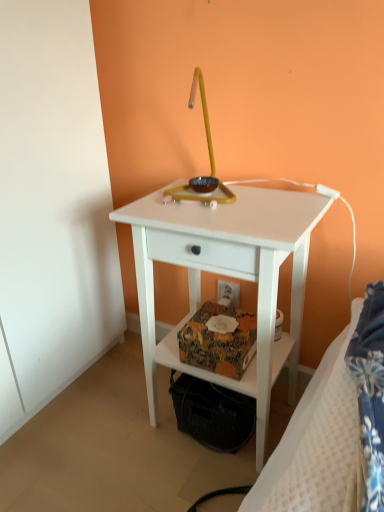
The height and width of the screenshot is (512, 384). What do you see at coordinates (227, 275) in the screenshot?
I see `white matte nightstand at center` at bounding box center [227, 275].

Locate an element on the screen. white plastic electric outlet at lower center is located at coordinates (228, 293).

Considering the sizes of objects white textured bed at lower right and white matte nightstand at center in the image provided, who is taller, white textured bed at lower right or white matte nightstand at center?

white matte nightstand at center is taller.

Where is `bed below the white matte nightstand at center (from the image's perspective)`? bed below the white matte nightstand at center (from the image's perspective) is located at coordinates (333, 426).

Are white textured bed at lower right and white matte nightstand at center making contact?

There is a gap between white textured bed at lower right and white matte nightstand at center.

Can white matte nightstand at center be found inside white textured bed at lower right?

No, white matte nightstand at center is not a part of white textured bed at lower right.

This screenshot has width=384, height=512. I want to click on bed in front of the white matte nightstand at center, so click(333, 426).

Is white matte nightstand at center completely or partially outside of white textured bed at lower right?

white matte nightstand at center is positioned outside white textured bed at lower right.

Considering the positions of objects white matte nightstand at center and white textured bed at lower right in the image provided, who is more to the right, white matte nightstand at center or white textured bed at lower right?

Positioned to the right is white textured bed at lower right.

Locate an element on the screen. bed below the white plastic electric outlet at lower center (from the image's perspective) is located at coordinates (333, 426).

Considering the points (277, 463) and (222, 298), which point is in front, point (277, 463) or point (222, 298)?

Point (277, 463)

From the image's perspective, which object appears higher, white textured bed at lower right or white plastic electric outlet at lower center?

white plastic electric outlet at lower center.

How far apart are white textured bed at lower right and white plastic electric outlet at lower center?

60.79 centimeters.

Does white plastic electric outlet at lower center have a greater height compared to white matte nightstand at center?

No.

Is white plastic electric outlet at lower center turned away from white matte nightstand at center?

That's not correct — white plastic electric outlet at lower center is not looking away from white matte nightstand at center.

Is point (225, 292) positioned before point (292, 276)?

No, it is not.

Based on the photo, from the image's perspective, is white plastic electric outlet at lower center beneath white matte nightstand at center?

No, from the image's perspective, white plastic electric outlet at lower center is not below white matte nightstand at center.

Visually, is white matte nightstand at center positioned to the left or to the right of white plastic electric outlet at lower center?

In the image, white matte nightstand at center appears on the left side of white plastic electric outlet at lower center.

From the picture: Is white matte nightstand at center looking in the opposite direction of white plastic electric outlet at lower center?

Yes, white matte nightstand at center is facing away from white plastic electric outlet at lower center.

Does white matte nightstand at center have a smaller size compared to white plastic electric outlet at lower center?

A: No, white matte nightstand at center is not smaller than white plastic electric outlet at lower center.

Between point (293, 348) and point (227, 293), which one is positioned in front?

The point (293, 348) is more forward.

Consider the image. Could you tell me if white plastic electric outlet at lower center is turned towards white textured bed at lower right?

No, white plastic electric outlet at lower center is not oriented towards white textured bed at lower right.

Choose the correct answer: Is white plastic electric outlet at lower center inside white textured bed at lower right or outside it?

white plastic electric outlet at lower center is outside white textured bed at lower right.

From a real-world perspective, which is physically below, white plastic electric outlet at lower center or white textured bed at lower right?

white plastic electric outlet at lower center, from a real-world perspective.

At what (x,y) coordinates should I click in order to perform the action: click on nightstand that is under the white textured bed at lower right (from a real-world perspective). Please return your answer as a coordinate pair (x, y). Looking at the image, I should click on (227, 275).

Find the location of a particular element. nightstand that appears behind the white textured bed at lower right is located at coordinates pos(227,275).

When comparing their distances from white plastic electric outlet at lower center, does white textured bed at lower right or white matte nightstand at center seem further?

white textured bed at lower right.

Looking at the image, which one is located further to white plastic electric outlet at lower center, white matte nightstand at center or white textured bed at lower right?

white textured bed at lower right lies further to white plastic electric outlet at lower center than the other object.

When comparing their distances from white matte nightstand at center, does white plastic electric outlet at lower center or white textured bed at lower right seem further?

Based on the image, white plastic electric outlet at lower center appears to be further to white matte nightstand at center.

Considering their positions, is white matte nightstand at center positioned further to white textured bed at lower right than white plastic electric outlet at lower center?

white plastic electric outlet at lower center lies further to white textured bed at lower right than the other object.

Based on the photo, from the image, which object appears to be farther from white textured bed at lower right, white plastic electric outlet at lower center or white matte nightstand at center?

Based on the image, white plastic electric outlet at lower center appears to be further to white textured bed at lower right.

Estimate the real-world distances between objects in this image. Which object is further from white matte nightstand at center, white textured bed at lower right or white plastic electric outlet at lower center?

The object further to white matte nightstand at center is white plastic electric outlet at lower center.

Locate an element on the screen. nightstand located between white textured bed at lower right and white plastic electric outlet at lower center in the depth direction is located at coordinates (227, 275).